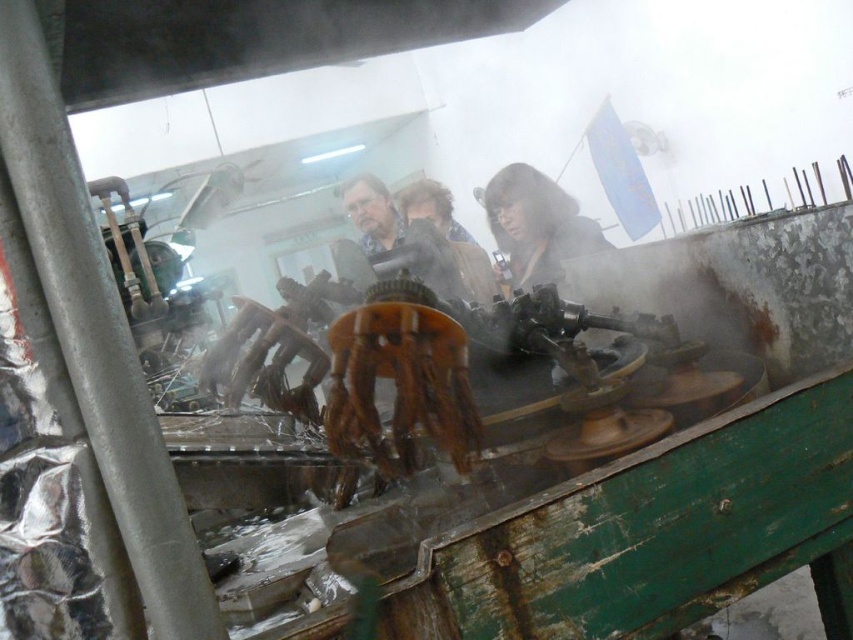
Where is the dark brown leather jacket at center located in the image?

The dark brown leather jacket at center is located at point (537, 225) in the image.